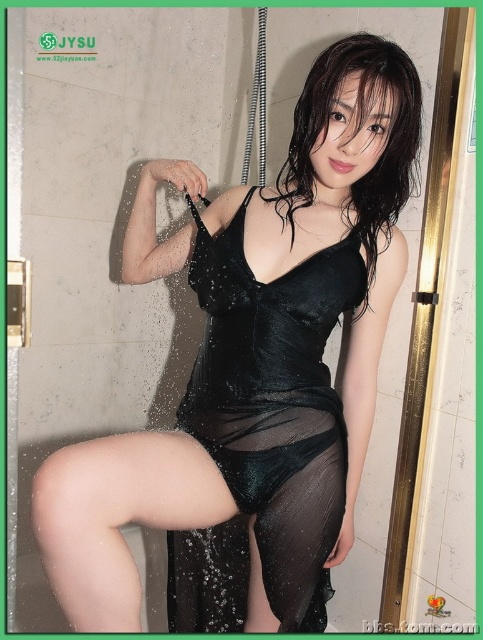
Looking at this image, you are a fashion designer observing a model wearing both a black sheer dress at center and a satin black dress at center in a shower scene. Which dress is visible in front of the other?

The black sheer dress at center is in front of the satin black dress at center because the satin black dress at center is positioned behind it.

You are a fashion designer observing the shower scene. You notice the black sheer skirt at lower center and the satin black dress at center. Which clothing item is closer to the floor?

The black sheer skirt at lower center is positioned under the satin black dress at center, so it is closer to the floor.